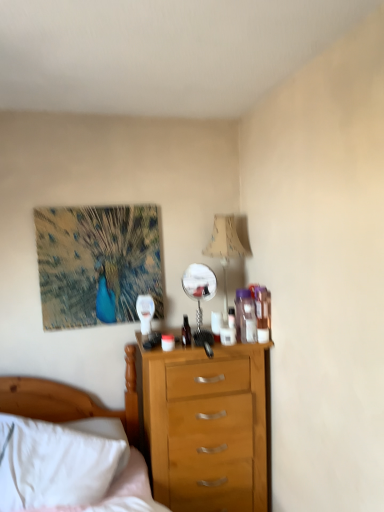
Question: Does polished silver mirror at center have a larger size compared to white soft bed at lower left?

Choices:
 (A) no
 (B) yes

Answer: (A)

Question: Is polished silver mirror at center smaller than white soft bed at lower left?

Choices:
 (A) yes
 (B) no

Answer: (A)

Question: Is polished silver mirror at center wider than white soft bed at lower left?

Choices:
 (A) no
 (B) yes

Answer: (A)

Question: From the image's perspective, is polished silver mirror at center below white soft bed at lower left?

Choices:
 (A) yes
 (B) no

Answer: (B)

Question: Is the depth of polished silver mirror at center less than that of white soft bed at lower left?

Choices:
 (A) yes
 (B) no

Answer: (B)

Question: Is polished silver mirror at center outside of white soft bed at lower left?

Choices:
 (A) yes
 (B) no

Answer: (A)

Question: Does polished silver mirror at center have a lesser height compared to beige fabric lampshade at upper right?

Choices:
 (A) yes
 (B) no

Answer: (A)

Question: Is polished silver mirror at center located outside beige fabric lampshade at upper right?

Choices:
 (A) no
 (B) yes

Answer: (A)

Question: Is the surface of polished silver mirror at center in direct contact with beige fabric lampshade at upper right?

Choices:
 (A) yes
 (B) no

Answer: (B)

Question: Is polished silver mirror at center positioned far away from beige fabric lampshade at upper right?

Choices:
 (A) no
 (B) yes

Answer: (A)

Question: From the image's perspective, is polished silver mirror at center under beige fabric lampshade at upper right?

Choices:
 (A) no
 (B) yes

Answer: (B)

Question: Is polished silver mirror at center wider than beige fabric lampshade at upper right?

Choices:
 (A) no
 (B) yes

Answer: (A)

Question: From the image's perspective, is white soft bed at lower left on top of textured canvas peacock at upper left?

Choices:
 (A) yes
 (B) no

Answer: (B)